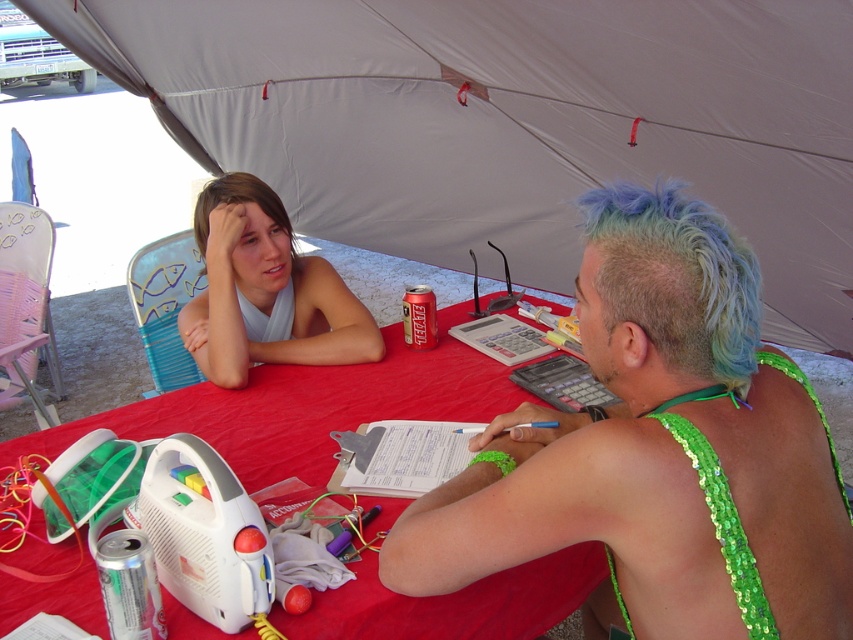
Does point (286, 323) come farther from viewer compared to point (422, 330)?

Yes, it is behind point (422, 330).

Which is above, white fabric at center or red matte can at center?

Positioned higher is white fabric at center.

Who is more forward, (x=233, y=372) or (x=415, y=314)?

Point (x=233, y=372) is in front.

Image resolution: width=853 pixels, height=640 pixels. Identify the location of white fabric at center. (265, 291).

Who is higher up, red fabric table at center or blonde hair at upper left?

Positioned higher is blonde hair at upper left.

Who is more forward, (x=260, y=412) or (x=202, y=234)?

Point (x=260, y=412) is more forward.

Where is `red fabric table at center`? The width and height of the screenshot is (853, 640). red fabric table at center is located at coordinates (306, 406).

Between point (683, 355) and point (270, 198), which one is positioned in front?

Point (683, 355)

Is blue dyed hair at upper right below blonde hair at upper left?

Indeed, blue dyed hair at upper right is positioned under blonde hair at upper left.

Between point (688, 289) and point (274, 200), which one is positioned in front?

Point (688, 289)

Locate an element on the screen. The width and height of the screenshot is (853, 640). blue dyed hair at upper right is located at coordinates (677, 278).